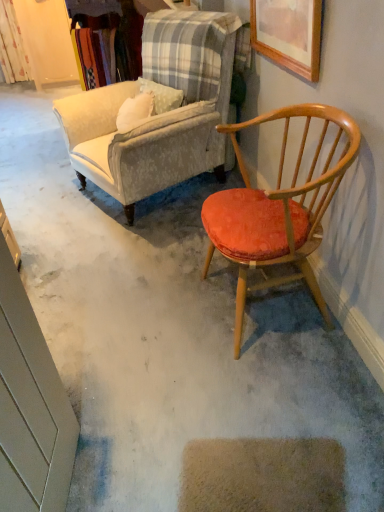
I want to click on vacant space underneath wooden armchair with orange cushion at right, positioned as the 1th chair in front-to-back order (from a real-world perspective), so click(266, 315).